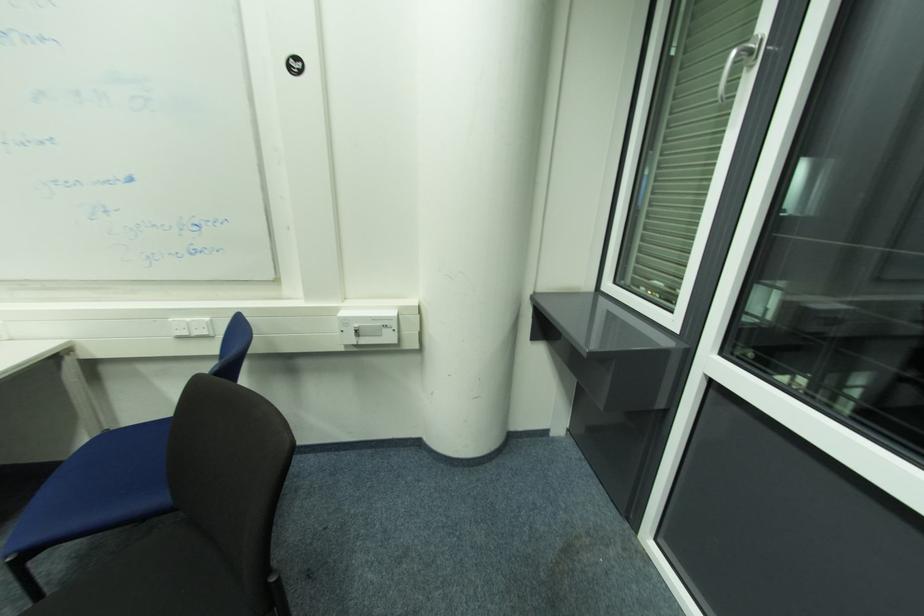
This screenshot has width=924, height=616. What do you see at coordinates (739, 60) in the screenshot? I see `a silver window handle` at bounding box center [739, 60].